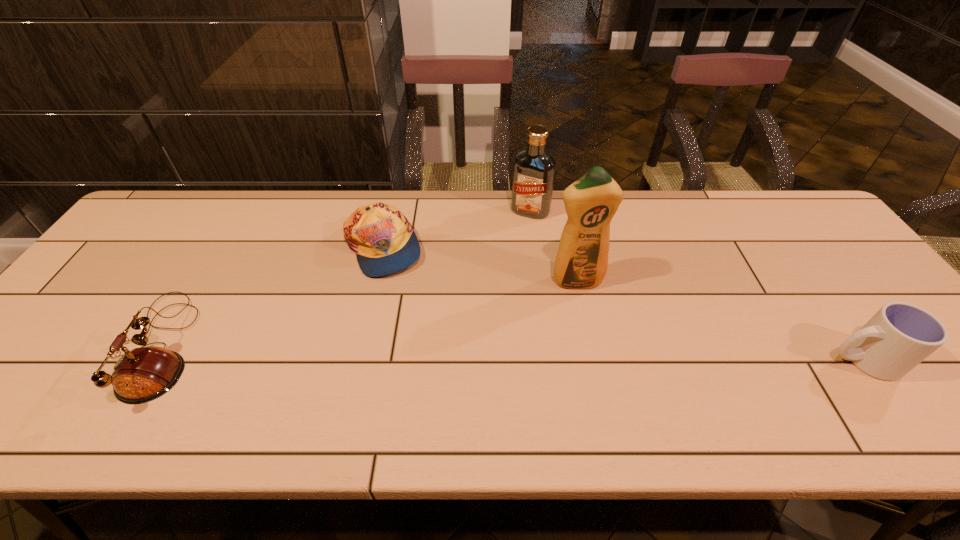
Identify the location of telephone. The width and height of the screenshot is (960, 540). (141, 375).

Find the location of `the rightmost object`. the rightmost object is located at coordinates (900, 335).

The width and height of the screenshot is (960, 540). I want to click on the tallest object, so click(x=581, y=262).

At what (x,y) coordinates should I click in order to perform the action: click on the second tallest object. Please return your answer as a coordinate pair (x, y). The image size is (960, 540). Looking at the image, I should click on [534, 169].

At what (x,y) coordinates should I click in order to perform the action: click on the fourth object from right to left. Please return your answer as a coordinate pair (x, y). Image resolution: width=960 pixels, height=540 pixels. Looking at the image, I should click on [x=384, y=241].

Find the location of a particular element. vacant space situated 0.190m on the rotary dial of the leftmost object is located at coordinates (36, 347).

Image resolution: width=960 pixels, height=540 pixels. Identify the location of vacant point located on the rotary dial of the leftmost object. (91, 347).

Find the location of a particular element. blank space located on the rotary dial of the leftmost object is located at coordinates (57, 347).

At what (x,y) coordinates should I click in order to perform the action: click on vacant area situated with the handle on the side of the rightmost object. Please return your answer as a coordinate pair (x, y). The image size is (960, 540). Looking at the image, I should click on click(x=786, y=360).

Identify the location of blank space located 0.140m with the handle on the side of the rightmost object. The width and height of the screenshot is (960, 540). (765, 360).